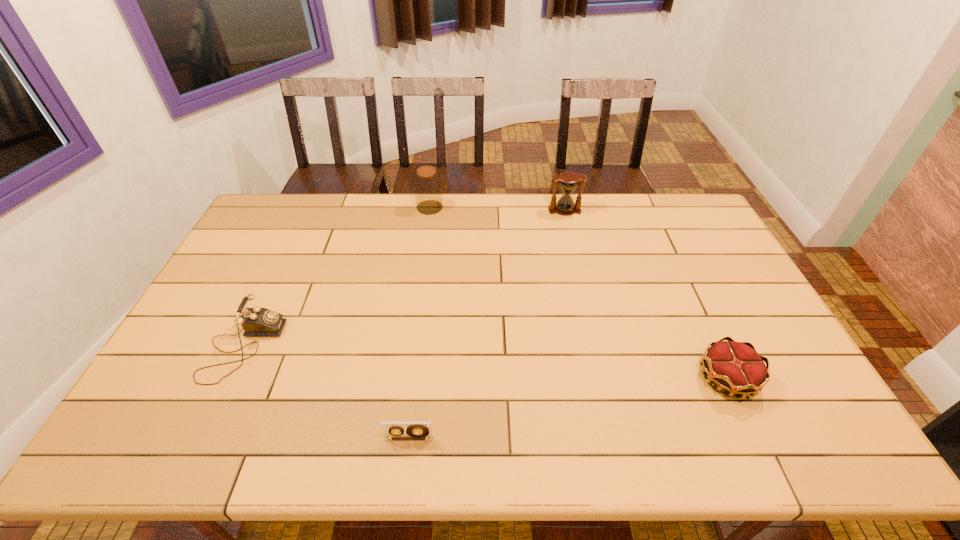
The image size is (960, 540). I want to click on free space located 0.300m on the back of the rightmost object, so click(x=680, y=277).

At what (x,y) coordinates should I click in order to perform the action: click on jar positioned at the far edge. Please return your answer as a coordinate pair (x, y). Image resolution: width=960 pixels, height=540 pixels. Looking at the image, I should click on (427, 184).

Find the location of a particular element. The height and width of the screenshot is (540, 960). hourglass at the far edge is located at coordinates (569, 181).

Locate an element on the screen. This screenshot has width=960, height=540. object situated at the near edge is located at coordinates (415, 430).

Where is `object positioned at the left edge`? This screenshot has width=960, height=540. object positioned at the left edge is located at coordinates pyautogui.click(x=256, y=321).

Identify the location of object that is at the right edge. This screenshot has height=540, width=960. (736, 367).

Locate an element on the screen. This screenshot has height=540, width=960. free space at the far edge of the desktop is located at coordinates (647, 199).

In the image, there is a desktop. At what (x,y) coordinates should I click in order to perform the action: click on vacant space at the near edge. Please return your answer as a coordinate pair (x, y). Looking at the image, I should click on (315, 438).

Locate an element on the screen. The height and width of the screenshot is (540, 960). vacant space at the left edge of the desktop is located at coordinates (248, 289).

In the image, there is a desktop. Identify the location of vacant space at the right edge. (733, 332).